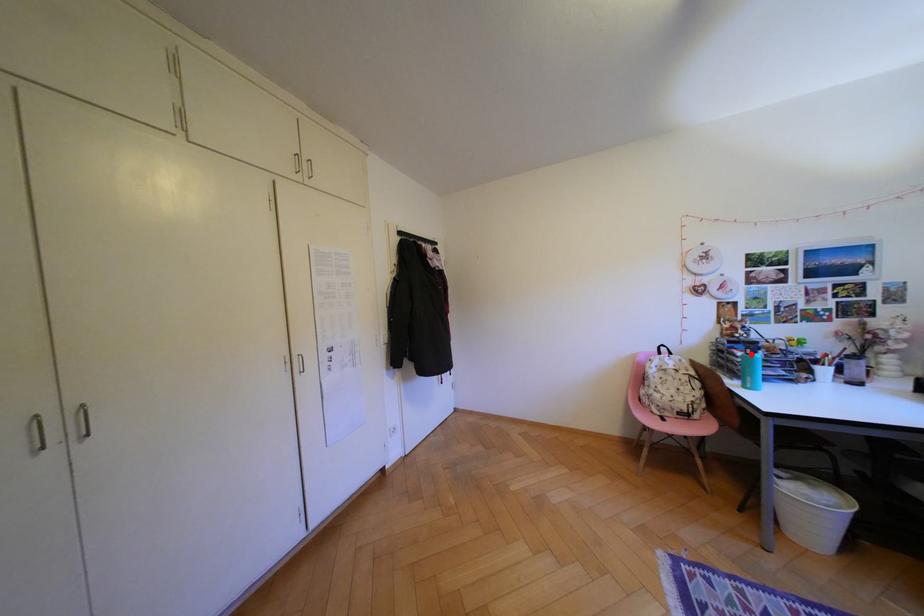
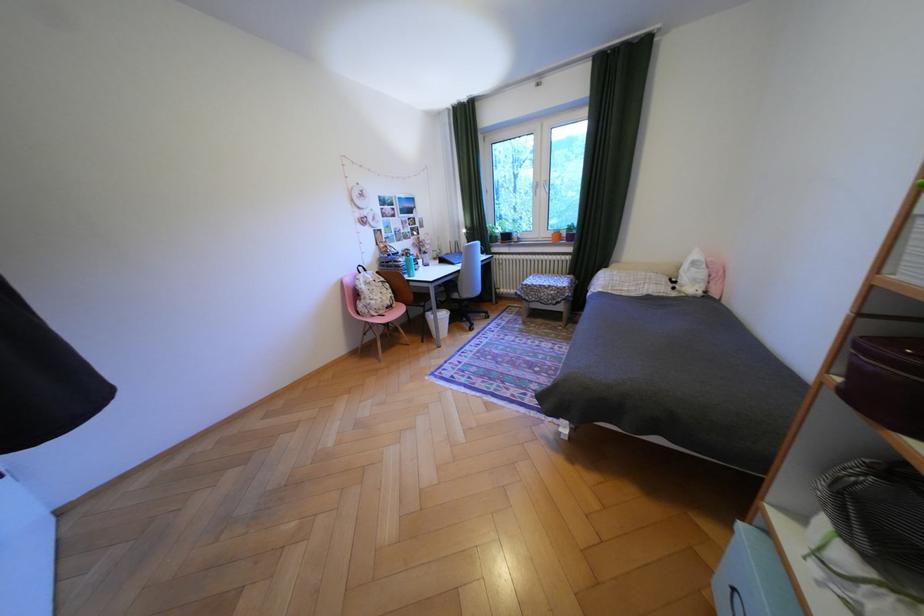
Question: A red point is marked in image1. In image2, is the corresponding 3D point closer to the camera or farther? Reply with the corresponding letter.

Choices:
 (A) The corresponding 3D point is closer.
 (B) The corresponding 3D point is farther.

Answer: (A)